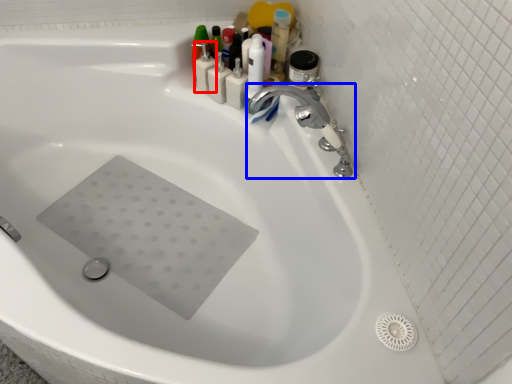
Question: Which point is further to the camera, toiletry (highlighted by a red box) or tap (highlighted by a blue box)?

Choices:
 (A) toiletry
 (B) tap

Answer: (A)